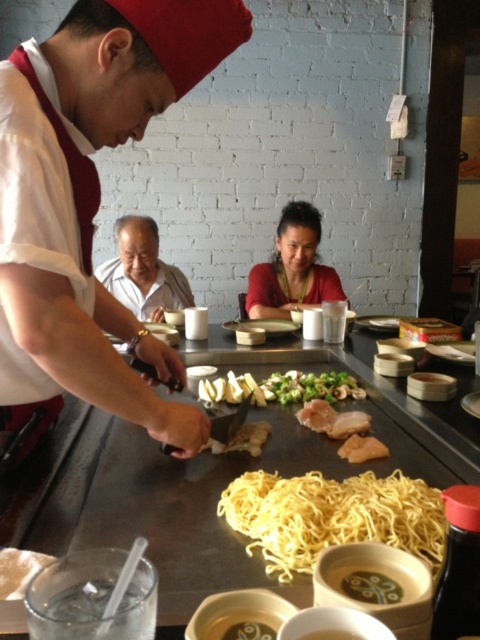
Image resolution: width=480 pixels, height=640 pixels. What do you see at coordinates (332, 516) in the screenshot?
I see `yellow matte noodles at center` at bounding box center [332, 516].

Does yellow matte noodles at center have a greater width compared to smooth white soup at lower center?

Yes, yellow matte noodles at center is wider than smooth white soup at lower center.

Identify the location of yellow matte noodles at center. The width and height of the screenshot is (480, 640). (332, 516).

At what (x,y) coordinates should I click in order to perform the action: click on yellow matte noodles at center. Please return your answer as a coordinate pair (x, y). Looking at the image, I should click on tap(332, 516).

Looking at this image, is shiny stainless steel table at center taller than brown crispy chicken at center?

Result: Yes.

Find the location of `shiny stainless steel table at center`. shiny stainless steel table at center is located at coordinates (223, 468).

I want to click on shiny stainless steel table at center, so click(223, 468).

At what (x,y) coordinates should I click in order to perform the action: click on shiny stainless steel table at center. Please return your answer as a coordinate pair (x, y). This screenshot has height=640, width=480. Looking at the image, I should click on (223, 468).

Does matte red blouse at center appear on the left side of smooth white soup at lower center?

In fact, matte red blouse at center is to the right of smooth white soup at lower center.

Does matte red blouse at center appear over smooth white soup at lower center?

Yes, matte red blouse at center is above smooth white soup at lower center.

Who is more distant from viewer, (295, 228) or (305, 636)?

Point (295, 228)

Where is `matte red blouse at center`? Image resolution: width=480 pixels, height=640 pixels. matte red blouse at center is located at coordinates (292, 268).